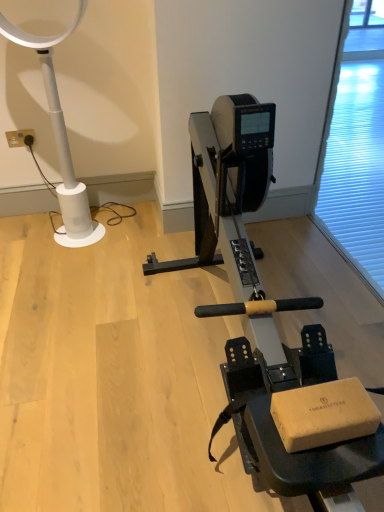
Question: Would you say white plastic lamp at left contains metallic silver stationary bicycle at center?

Choices:
 (A) no
 (B) yes

Answer: (A)

Question: Can you confirm if white plastic lamp at left is thinner than metallic silver stationary bicycle at center?

Choices:
 (A) yes
 (B) no

Answer: (A)

Question: From the image's perspective, is white plastic lamp at left under metallic silver stationary bicycle at center?

Choices:
 (A) yes
 (B) no

Answer: (B)

Question: Is white plastic lamp at left to the right of metallic silver stationary bicycle at center from the viewer's perspective?

Choices:
 (A) yes
 (B) no

Answer: (B)

Question: Considering the relative positions of white plastic lamp at left and metallic silver stationary bicycle at center in the image provided, is white plastic lamp at left to the left of metallic silver stationary bicycle at center from the viewer's perspective?

Choices:
 (A) no
 (B) yes

Answer: (B)

Question: Is white plastic lamp at left shorter than metallic silver stationary bicycle at center?

Choices:
 (A) no
 (B) yes

Answer: (A)

Question: Is the depth of transparent plastic screen door at right less than that of white plastic electric outlet at upper left?

Choices:
 (A) no
 (B) yes

Answer: (B)

Question: Is the depth of transparent plastic screen door at right greater than that of white plastic electric outlet at upper left?

Choices:
 (A) yes
 (B) no

Answer: (B)

Question: Is white plastic electric outlet at upper left surrounded by transparent plastic screen door at right?

Choices:
 (A) yes
 (B) no

Answer: (B)

Question: Is transparent plastic screen door at right facing away from white plastic electric outlet at upper left?

Choices:
 (A) yes
 (B) no

Answer: (B)

Question: Considering the relative sizes of transparent plastic screen door at right and white plastic electric outlet at upper left in the image provided, is transparent plastic screen door at right smaller than white plastic electric outlet at upper left?

Choices:
 (A) no
 (B) yes

Answer: (A)

Question: From the image's perspective, does transparent plastic screen door at right appear lower than white plastic electric outlet at upper left?

Choices:
 (A) yes
 (B) no

Answer: (A)

Question: Is transparent plastic screen door at right facing towards metallic silver stationary bicycle at center?

Choices:
 (A) no
 (B) yes

Answer: (B)